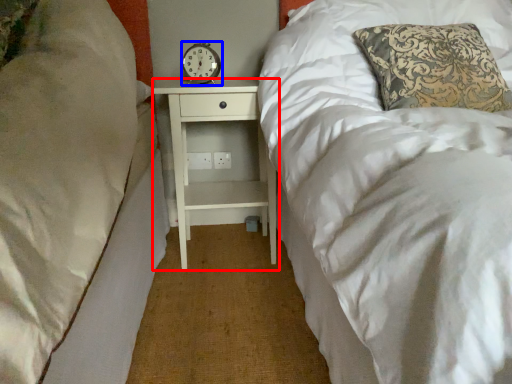
Question: Which point is closer to the camera, nightstand (highlighted by a red box) or clock (highlighted by a blue box)?

Choices:
 (A) nightstand
 (B) clock

Answer: (A)